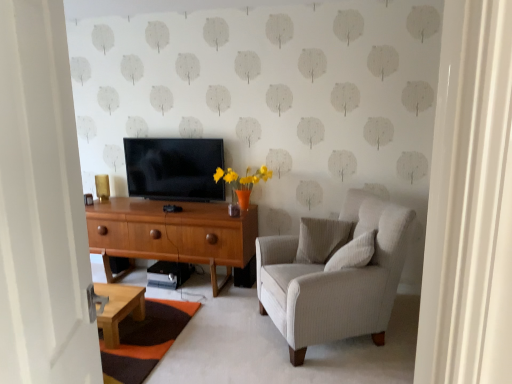
This screenshot has height=384, width=512. In order to click on free spot to the left of light gray fabric armchair at right in this screenshot , I will do `click(230, 338)`.